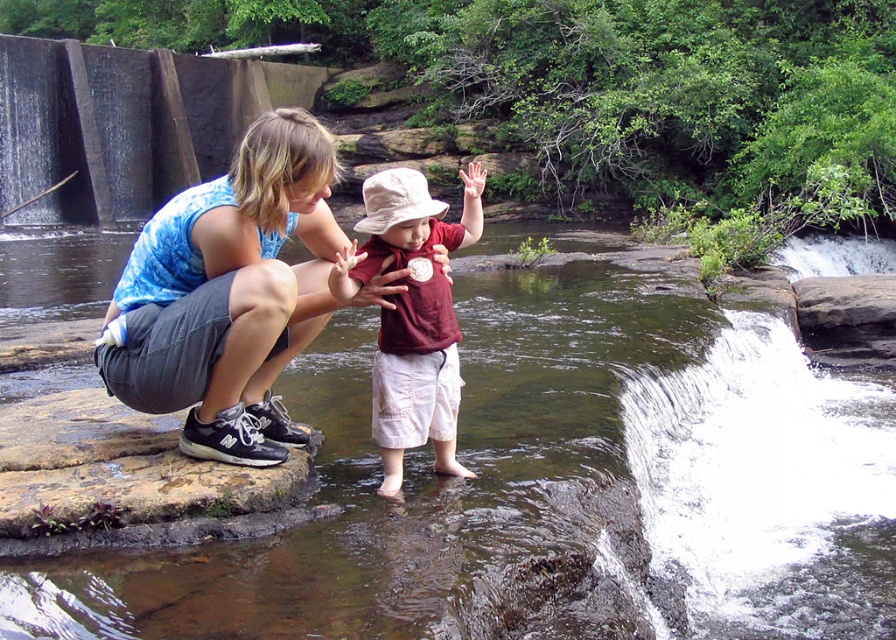
You are standing at the point marked by the coordinates point [549,492]. What is the nearest object to you in the scene?

The nearest object to you at point [549,492] is the clear water at creek center, as the coordinates directly correspond to this location.